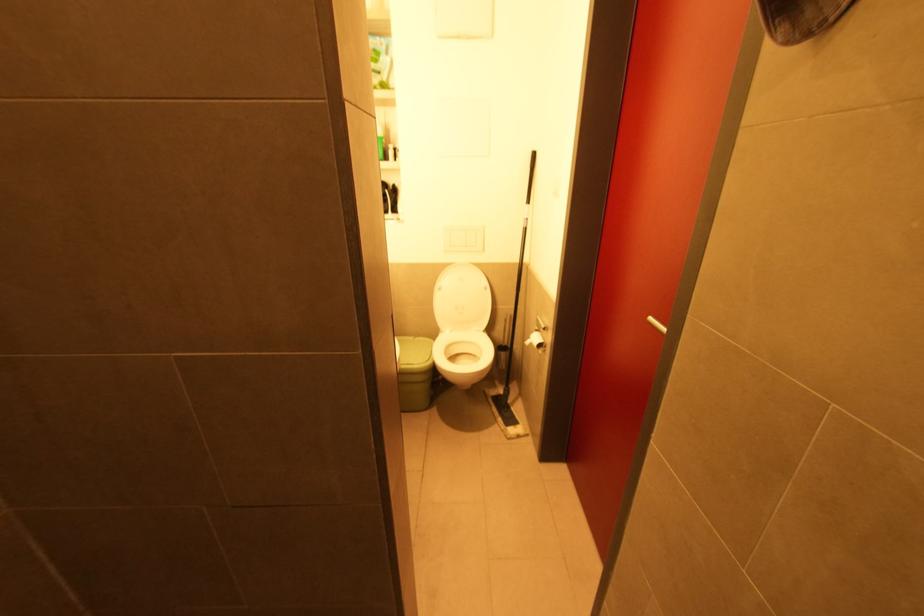
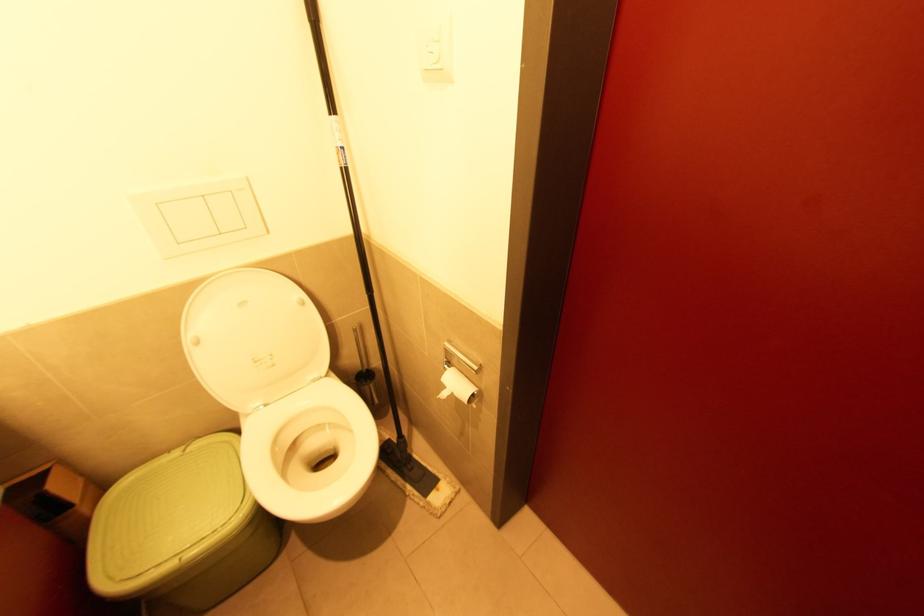
Locate, in the second image, the point that corresponds to point 530,339 in the first image.

(444, 387)